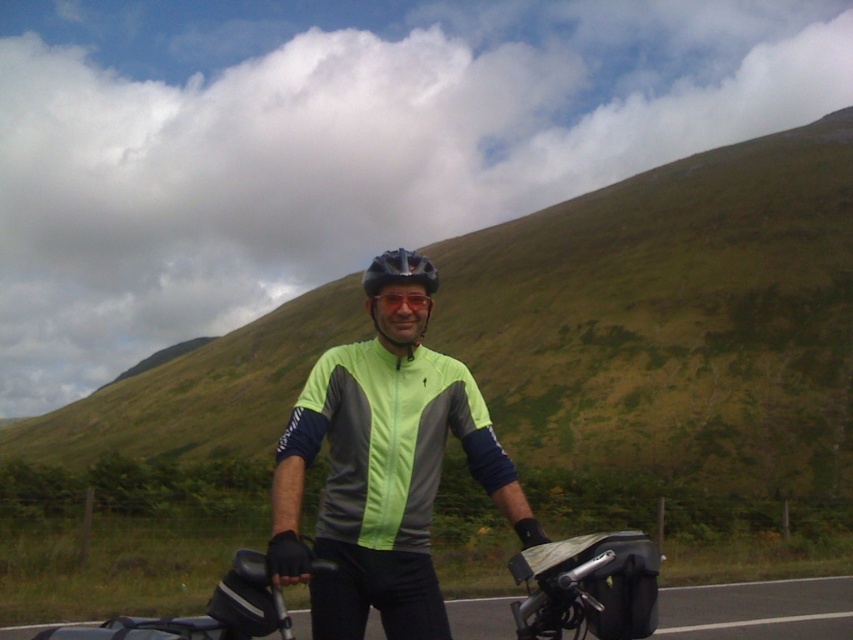
Can you confirm if black textured bag at center is shorter than matte black helmet at center?

Yes.

Can you confirm if black textured bag at center is positioned below matte black helmet at center?

Correct, black textured bag at center is located below matte black helmet at center.

Between point (595, 532) and point (415, 252), which one is positioned behind?

Positioned behind is point (595, 532).

Locate an element on the screen. The width and height of the screenshot is (853, 640). black textured bag at center is located at coordinates tap(589, 586).

Is neon green fabric jacket at center closer to the viewer compared to transparent plastic goggles at center?

Yes, it is in front of transparent plastic goggles at center.

Does neon green fabric jacket at center appear on the left side of transparent plastic goggles at center?

Indeed, neon green fabric jacket at center is positioned on the left side of transparent plastic goggles at center.

Is point (389, 372) less distant than point (402, 292)?

No, it is behind (402, 292).

You are a GUI agent. You are given a task and a screenshot of the screen. Output one action in this format:
    pyautogui.click(x=<x>, y=<y>)
    Task: Click on the neon green fabric jacket at center
    This screenshot has width=853, height=640.
    Given the screenshot: What is the action you would take?
    pyautogui.click(x=381, y=477)

Does neon green fabric jacket at center appear on the left side of matte black helmet at center?

No, neon green fabric jacket at center is not to the left of matte black helmet at center.

Which is in front, point (271, 538) or point (380, 268)?

Point (271, 538) is in front.

Who is more distant from viewer, (393, 524) or (427, 276)?

Point (427, 276)

Locate an element on the screen. The height and width of the screenshot is (640, 853). neon green fabric jacket at center is located at coordinates (381, 477).